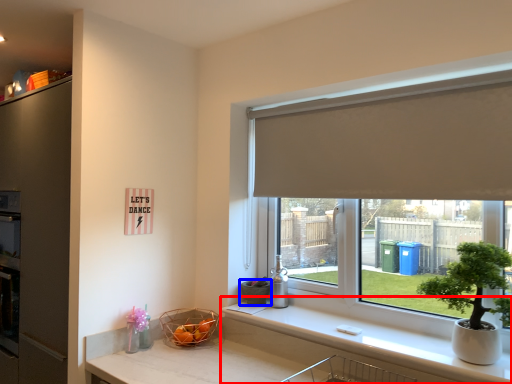
Question: Which object appears closest to the camera in this image, counter top (highlighted by a red box) or flowerpot (highlighted by a blue box)?

Choices:
 (A) counter top
 (B) flowerpot

Answer: (A)